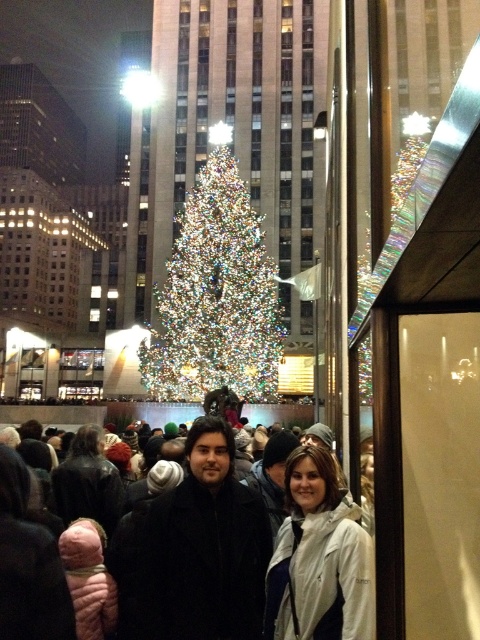
Question: Can you confirm if black wool coat at center is positioned to the left of white matte jacket at center?

Choices:
 (A) yes
 (B) no

Answer: (A)

Question: Is black wool coat at center closer to camera compared to white matte jacket at center?

Choices:
 (A) yes
 (B) no

Answer: (A)

Question: Which of these objects is positioned farthest from the black wool coat at center?

Choices:
 (A) white matte jacket at center
 (B) illuminated glass christmas tree at center

Answer: (B)

Question: Which of these objects is positioned closest to the illuminated glass christmas tree at center?

Choices:
 (A) black wool coat at center
 (B) white matte jacket at center

Answer: (A)

Question: Among these objects, which one is nearest to the camera?

Choices:
 (A) white matte jacket at center
 (B) black wool coat at center
 (C) illuminated glass christmas tree at center

Answer: (B)

Question: Is illuminated glass christmas tree at center smaller than white matte jacket at center?

Choices:
 (A) no
 (B) yes

Answer: (A)